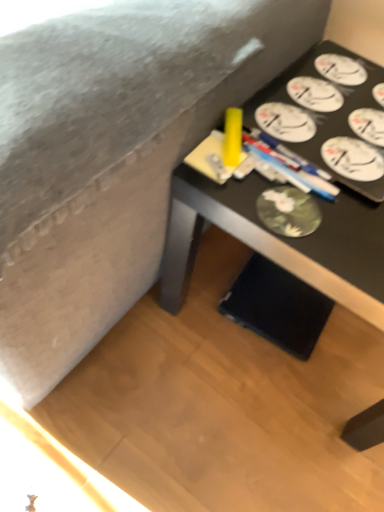
Identify the location of black matte desk at lower right. (279, 241).

From the picture: What is the approximate width of black matte desk at lower right?

black matte desk at lower right is 25.01 inches wide.

Describe the element at coordinates (279, 241) in the screenshot. The width and height of the screenshot is (384, 512). I see `black matte desk at lower right` at that location.

Find the location of a particular element. black matte desk at lower right is located at coordinates (279, 241).